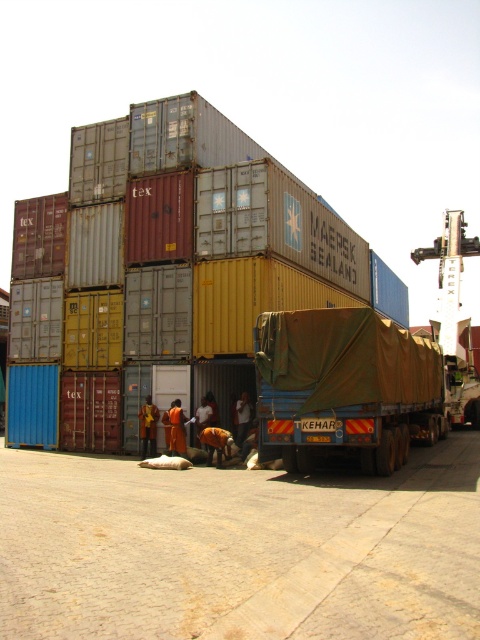
Question: Which object appears farthest from the camera in this image?

Choices:
 (A) brown canvas trailer truck at center
 (B) camouflage fabric tarpaulin at center

Answer: (B)

Question: Among these objects, which one is nearest to the camera?

Choices:
 (A) brown canvas trailer truck at center
 (B) camouflage fabric tarpaulin at center

Answer: (A)

Question: Is camouflage fabric tarpaulin at center to the left of brown canvas trailer truck at center from the viewer's perspective?

Choices:
 (A) no
 (B) yes

Answer: (B)

Question: Can you confirm if camouflage fabric tarpaulin at center is thinner than brown canvas trailer truck at center?

Choices:
 (A) yes
 (B) no

Answer: (B)

Question: Is camouflage fabric tarpaulin at center further to camera compared to brown canvas trailer truck at center?

Choices:
 (A) yes
 (B) no

Answer: (A)